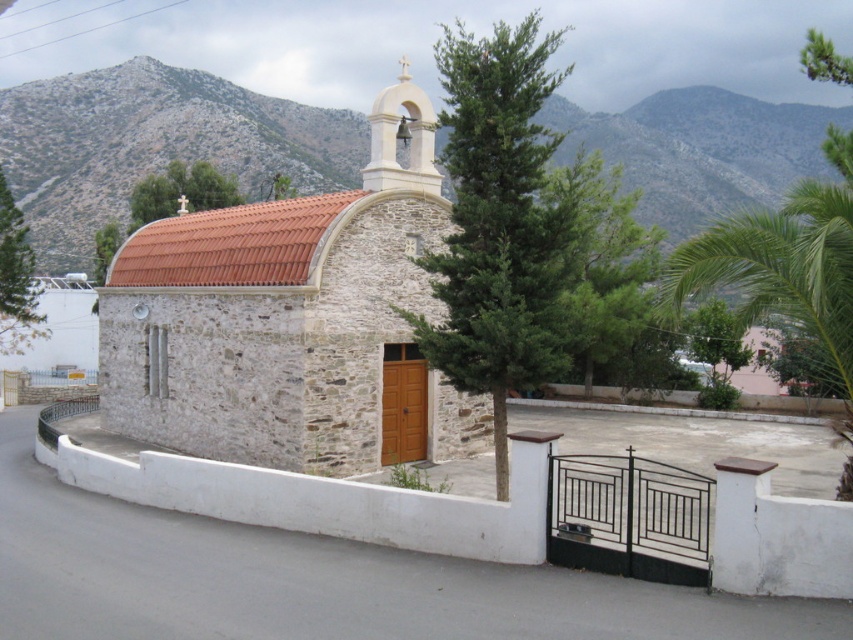
You are standing in front of the church and looking towards the upper center. Which object, the gray rocky mountain at upper center or the green leafy tree at upper center, would appear bigger to you?

The gray rocky mountain at upper center is larger in size than the green leafy tree at upper center, so it would appear bigger to you.

You are standing at the entrance of the church and want to take a photo of the green leafy palm tree at center. Which direction should you face to capture it in your view?

The green leafy palm tree at center is located at point (498, 224), which is to the right side of the entrance. Therefore, you should face towards the right side to capture it in your view.

You are standing in the courtyard of the church and want to take a photo of both the gray rocky mountain at upper center and the green leafy palm tree at center. Which object should you point your camera towards first to ensure both are in the frame?

You should point your camera towards the gray rocky mountain at upper center first because it is located above the green leafy palm tree at center, so adjusting the frame to include the higher object first will help capture both in the photo.